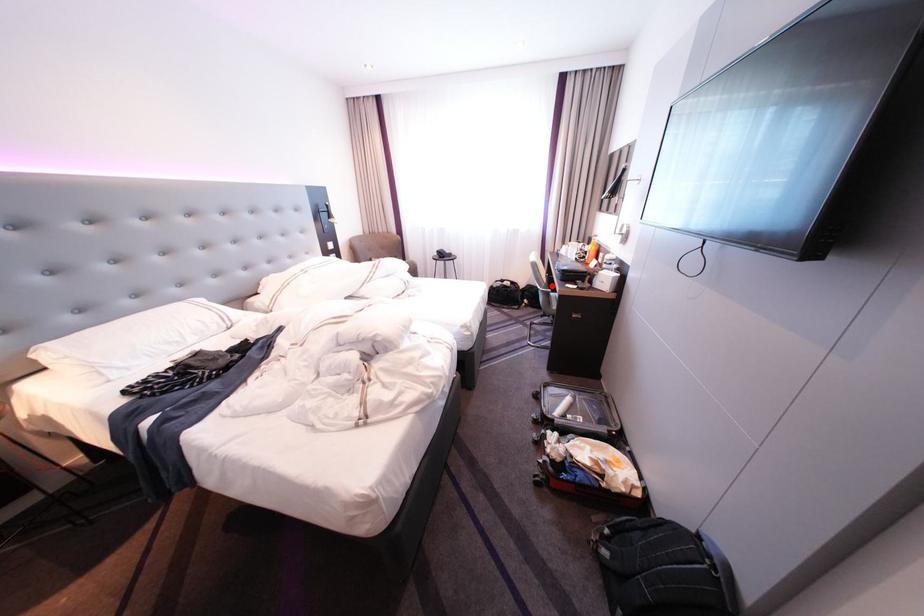
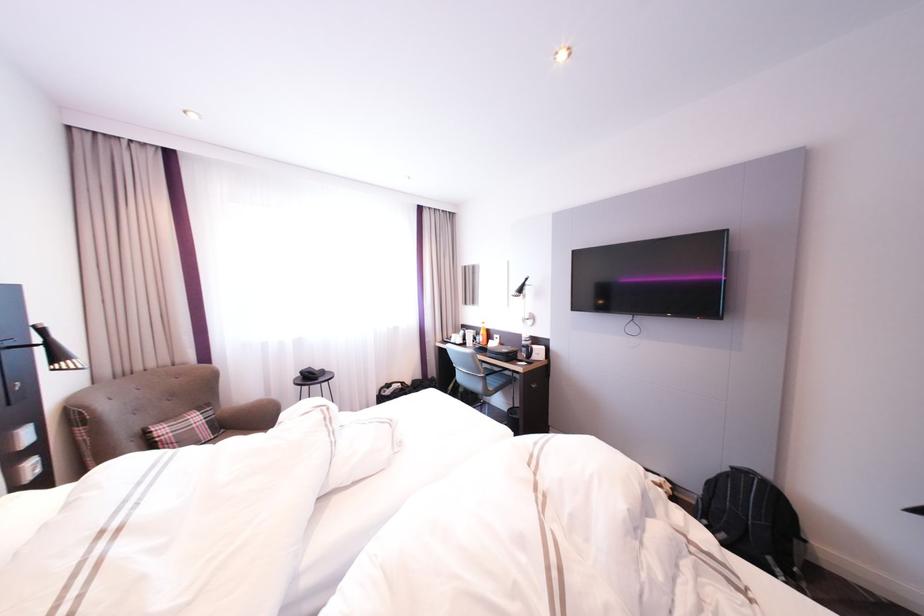
In the second image, find the point that corresponds to the highlighted location in the first image.

(492, 373)